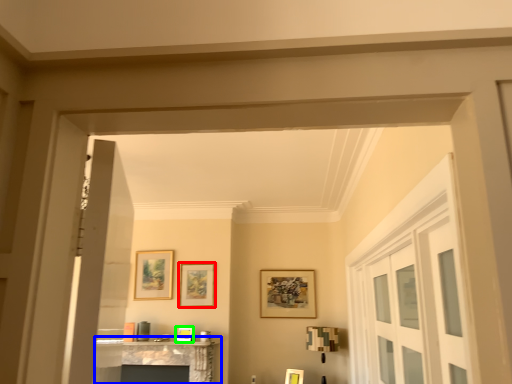
Question: Considering the real-world distances, which object is farthest from picture frame (highlighted by a red box)? table (highlighted by a blue box) or picture frame (highlighted by a green box)?

Choices:
 (A) table
 (B) picture frame

Answer: (A)